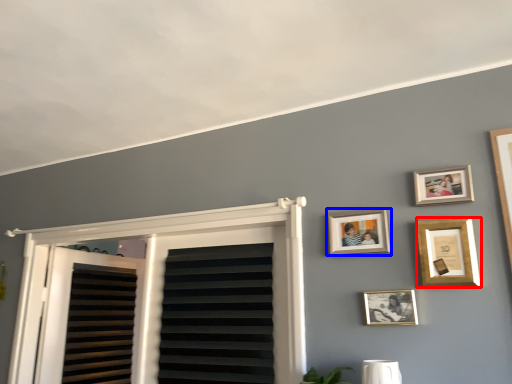
Question: Among these objects, which one is farthest to the camera, picture frame (highlighted by a red box) or picture frame (highlighted by a blue box)?

Choices:
 (A) picture frame
 (B) picture frame

Answer: (B)